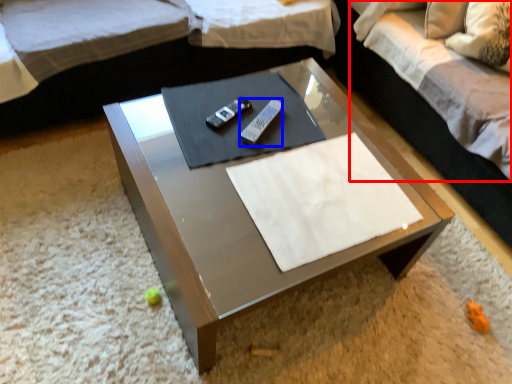
Question: Which point is further to the camera, bedding (highlighted by a red box) or remote (highlighted by a blue box)?

Choices:
 (A) bedding
 (B) remote

Answer: (B)